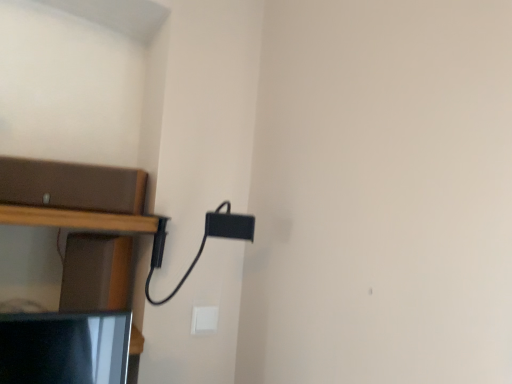
Image resolution: width=512 pixels, height=384 pixels. Find the location of `brown matte shelf at left`. brown matte shelf at left is located at coordinates (72, 186).

What do you see at coordinates (72, 186) in the screenshot? I see `brown matte shelf at left` at bounding box center [72, 186].

Consider the image. What is the approximate height of white plastic light switch at lower center?

white plastic light switch at lower center is 3.50 inches tall.

Image resolution: width=512 pixels, height=384 pixels. What do you see at coordinates (204, 319) in the screenshot?
I see `white plastic light switch at lower center` at bounding box center [204, 319].

Where is `white plastic light switch at lower center`? This screenshot has height=384, width=512. white plastic light switch at lower center is located at coordinates (204, 319).

This screenshot has height=384, width=512. In order to click on brown matte shelf at left in this screenshot , I will do `click(72, 186)`.

Between white plastic light switch at lower center and brown matte shelf at left, which one appears on the left side from the viewer's perspective?

brown matte shelf at left.

Does white plastic light switch at lower center come behind brown matte shelf at left?

Yes, it is.

Is point (216, 323) closer to camera compared to point (128, 183)?

No, it is not.

From the image's perspective, would you say white plastic light switch at lower center is positioned over brown matte shelf at left?

Result: No.

From a real-world perspective, between white plastic light switch at lower center and brown matte shelf at left, who is vertically higher?

brown matte shelf at left.

Considering the relative sizes of white plastic light switch at lower center and brown matte shelf at left in the image provided, is white plastic light switch at lower center wider than brown matte shelf at left?

Incorrect, the width of white plastic light switch at lower center does not surpass that of brown matte shelf at left.

Can you confirm if white plastic light switch at lower center is shorter than brown matte shelf at left?

Correct, white plastic light switch at lower center is not as tall as brown matte shelf at left.

From the picture: Based on their sizes in the image, would you say white plastic light switch at lower center is bigger or smaller than brown matte shelf at left?

Considering their sizes, white plastic light switch at lower center takes up less space than brown matte shelf at left.

In the scene shown: Is brown matte shelf at left surrounded by white plastic light switch at lower center?

No, brown matte shelf at left is not surrounded by white plastic light switch at lower center.

Is there a large distance between white plastic light switch at lower center and brown matte shelf at left?

That's not correct — white plastic light switch at lower center is a little close to brown matte shelf at left.

Does white plastic light switch at lower center turn towards brown matte shelf at left?

No, white plastic light switch at lower center is not facing towards brown matte shelf at left.

How different are the orientations of white plastic light switch at lower center and brown matte shelf at left in degrees?

The angle between the facing direction of white plastic light switch at lower center and the facing direction of brown matte shelf at left is 24.6 degrees.

How much distance is there between white plastic light switch at lower center and brown matte shelf at left?

white plastic light switch at lower center and brown matte shelf at left are 19.12 inches apart from each other.

Where is `shelf located in front of the white plastic light switch at lower center`? The height and width of the screenshot is (384, 512). shelf located in front of the white plastic light switch at lower center is located at coordinates pyautogui.click(x=72, y=186).

Does brown matte shelf at left appear on the right side of white plastic light switch at lower center?

Incorrect, brown matte shelf at left is not on the right side of white plastic light switch at lower center.

Is brown matte shelf at left behind white plastic light switch at lower center?

No, the depth of brown matte shelf at left is less than that of white plastic light switch at lower center.

Between point (102, 168) and point (202, 311), which one is positioned behind?

The point (202, 311) is behind.

From the image's perspective, between brown matte shelf at left and white plastic light switch at lower center, which one is located above?

brown matte shelf at left is shown above in the image.

From a real-world perspective, is brown matte shelf at left physically above white plastic light switch at lower center?

Indeed, from a real-world perspective, brown matte shelf at left stands above white plastic light switch at lower center.

Looking at their sizes, would you say brown matte shelf at left is wider or thinner than white plastic light switch at lower center?

Considering their sizes, brown matte shelf at left looks broader than white plastic light switch at lower center.

Considering the relative sizes of brown matte shelf at left and white plastic light switch at lower center in the image provided, is brown matte shelf at left taller than white plastic light switch at lower center?

Yes.

Does brown matte shelf at left have a larger size compared to white plastic light switch at lower center?

Correct, brown matte shelf at left is larger in size than white plastic light switch at lower center.

Would you say brown matte shelf at left is inside or outside white plastic light switch at lower center?

brown matte shelf at left cannot be found inside white plastic light switch at lower center.

Are brown matte shelf at left and white plastic light switch at lower center far apart?

They are positioned close to each other.

Is brown matte shelf at left facing away from white plastic light switch at lower center?

That's not correct — brown matte shelf at left is not looking away from white plastic light switch at lower center.

How many degrees apart are the facing directions of brown matte shelf at left and white plastic light switch at lower center?

They differ by 24.6 degrees in their facing directions.

At what (x,y) coordinates should I click in order to perform the action: click on shelf on the left of white plastic light switch at lower center. Please return your answer as a coordinate pair (x, y). Looking at the image, I should click on (72, 186).

The height and width of the screenshot is (384, 512). In order to click on light switch to the right of brown matte shelf at left in this screenshot , I will do `click(204, 319)`.

Where is `shelf above the white plastic light switch at lower center (from a real-world perspective)`? The image size is (512, 384). shelf above the white plastic light switch at lower center (from a real-world perspective) is located at coordinates point(72,186).